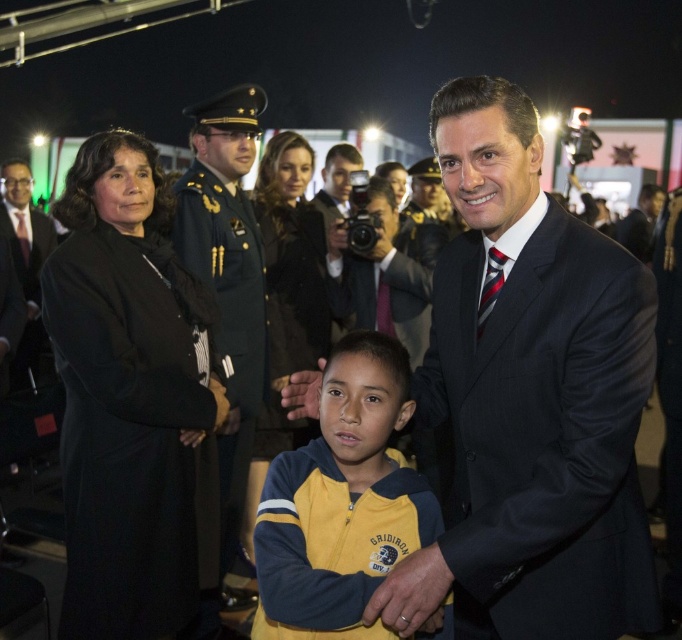
Does dark blue pinstripe suit at center appear under matte black suit at left?

Yes.

Between point (614, 528) and point (38, 348), which one is positioned in front?

Point (614, 528)

This screenshot has height=640, width=682. Describe the element at coordinates (546, 428) in the screenshot. I see `dark blue pinstripe suit at center` at that location.

At what (x,y) coordinates should I click in order to perform the action: click on dark blue pinstripe suit at center. Please return your answer as a coordinate pair (x, y). Image resolution: width=682 pixels, height=640 pixels. Looking at the image, I should click on (546, 428).

Does black wool coat at left come behind shiny dark blue uniform at center?

No, it is in front of shiny dark blue uniform at center.

Between black wool coat at left and shiny dark blue uniform at center, which one has less height?

Standing shorter between the two is black wool coat at left.

This screenshot has height=640, width=682. What do you see at coordinates (128, 429) in the screenshot? I see `black wool coat at left` at bounding box center [128, 429].

This screenshot has width=682, height=640. I want to click on black wool coat at left, so click(128, 429).

This screenshot has height=640, width=682. Identify the location of black wool coat at left. (128, 429).

This screenshot has width=682, height=640. Describe the element at coordinates (128, 429) in the screenshot. I see `black wool coat at left` at that location.

Is point (194, 600) positioned behind point (40, 237)?

That is False.

Where is `black wool coat at left`? This screenshot has height=640, width=682. black wool coat at left is located at coordinates (128, 429).